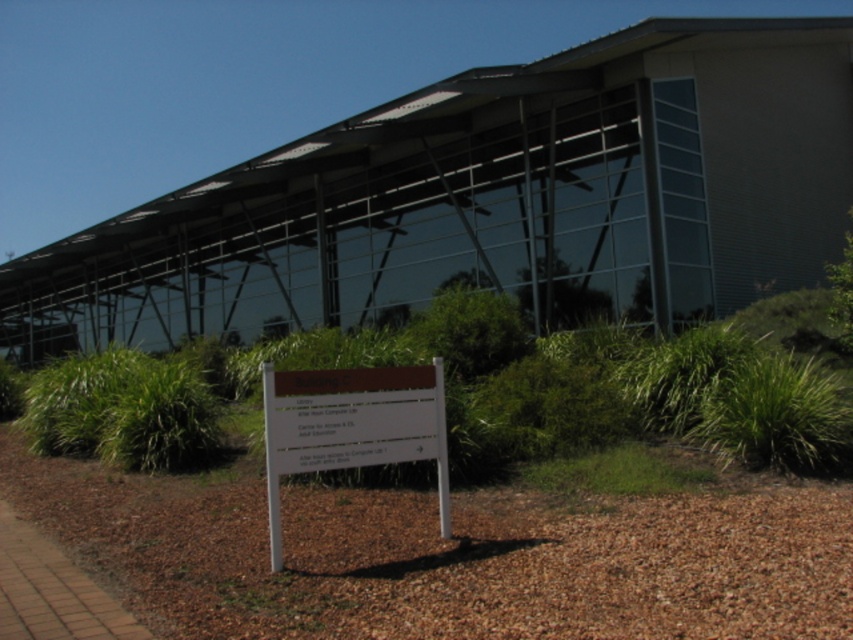
Question: Among these points, which one is nearest to the camera?

Choices:
 (A) [744, 381]
 (B) [548, 484]

Answer: (B)

Question: Which object appears farthest from the camera in this image?

Choices:
 (A) green grass at lower right
 (B) green grass at lower center
 (C) brown matte sign at center

Answer: (A)

Question: Does brown matte sign at center have a greater width compared to green grass at lower right?

Choices:
 (A) yes
 (B) no

Answer: (B)

Question: Among these objects, which one is nearest to the camera?

Choices:
 (A) brown matte sign at center
 (B) green grass at lower center
 (C) green grass at lower right

Answer: (A)

Question: Is brown matte sign at center wider than green grass at lower right?

Choices:
 (A) no
 (B) yes

Answer: (A)

Question: Does green grass at lower right appear on the left side of green grass at lower center?

Choices:
 (A) no
 (B) yes

Answer: (A)